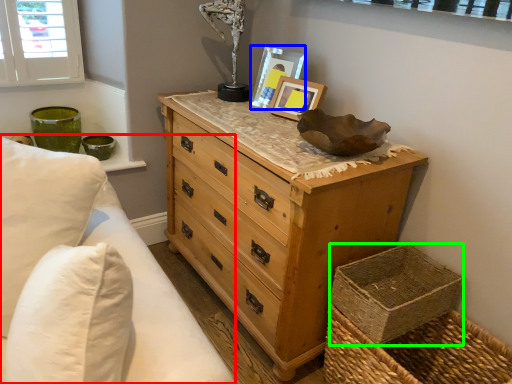
Question: Which is farther away from bedding (highlighted by a red box)? picture frame (highlighted by a blue box) or basket container (highlighted by a green box)?

Choices:
 (A) picture frame
 (B) basket container

Answer: (A)